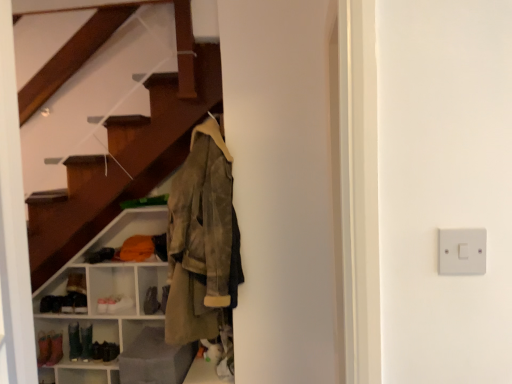
Question: Is matte gray ottoman at lower left at the back of matte white shelving unit at lower left?

Choices:
 (A) no
 (B) yes

Answer: (A)

Question: Considering the relative positions of matte white shelving unit at lower left and matte gray ottoman at lower left in the image provided, is matte white shelving unit at lower left to the right of matte gray ottoman at lower left from the viewer's perspective?

Choices:
 (A) no
 (B) yes

Answer: (A)

Question: Are matte white shelving unit at lower left and matte gray ottoman at lower left far apart?

Choices:
 (A) no
 (B) yes

Answer: (A)

Question: From the image's perspective, does matte white shelving unit at lower left appear lower than matte gray ottoman at lower left?

Choices:
 (A) no
 (B) yes

Answer: (A)

Question: Does matte white shelving unit at lower left have a lesser width compared to matte gray ottoman at lower left?

Choices:
 (A) yes
 (B) no

Answer: (B)

Question: Is matte white shelving unit at lower left taller than matte gray ottoman at lower left?

Choices:
 (A) no
 (B) yes

Answer: (B)

Question: Considering the relative positions of olive suede jacket at center and leather shoe at lower left in the image provided, is olive suede jacket at center behind leather shoe at lower left?

Choices:
 (A) yes
 (B) no

Answer: (B)

Question: Is olive suede jacket at center shorter than leather shoe at lower left?

Choices:
 (A) no
 (B) yes

Answer: (A)

Question: Is olive suede jacket at center directly adjacent to leather shoe at lower left?

Choices:
 (A) no
 (B) yes

Answer: (A)

Question: Are olive suede jacket at center and leather shoe at lower left located far from each other?

Choices:
 (A) yes
 (B) no

Answer: (A)

Question: Could you tell me if olive suede jacket at center is facing leather shoe at lower left?

Choices:
 (A) yes
 (B) no

Answer: (B)

Question: Is leather shoe at lower left a part of olive suede jacket at center?

Choices:
 (A) no
 (B) yes

Answer: (A)

Question: From the image's perspective, would you say leather shoe at lower left is shown under olive suede jacket at center?

Choices:
 (A) yes
 (B) no

Answer: (A)